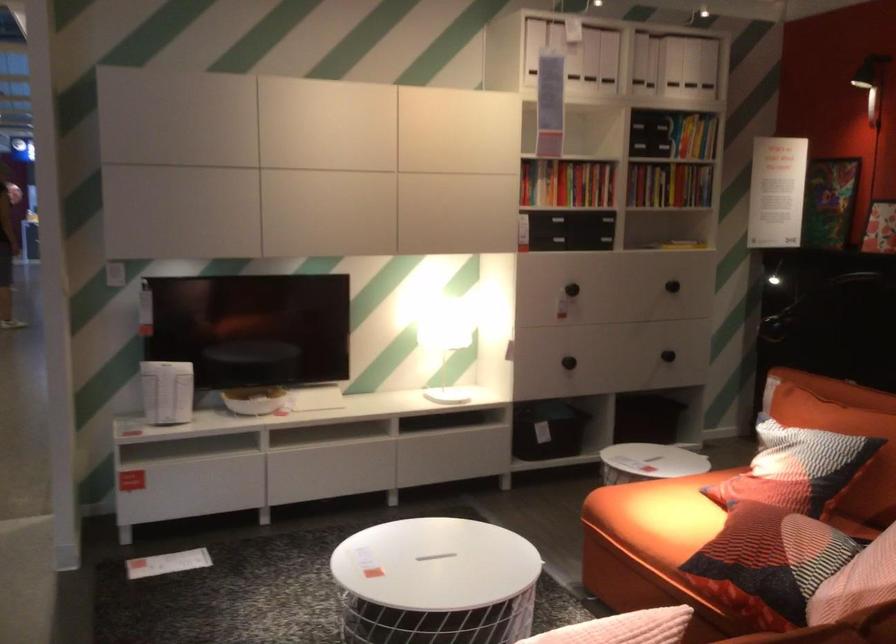
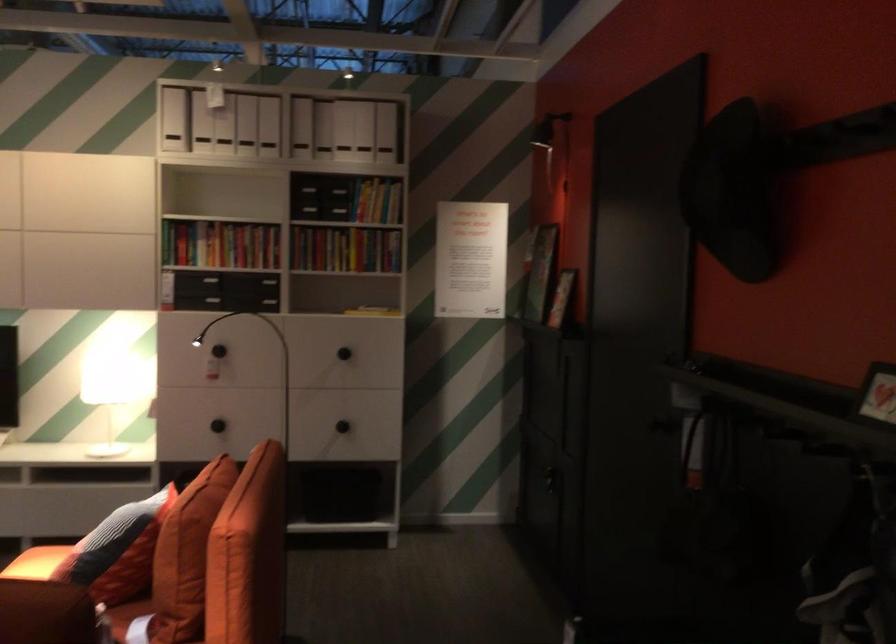
Locate, in the second image, the point that corresponds to [606,348] in the first image.

(218, 426)